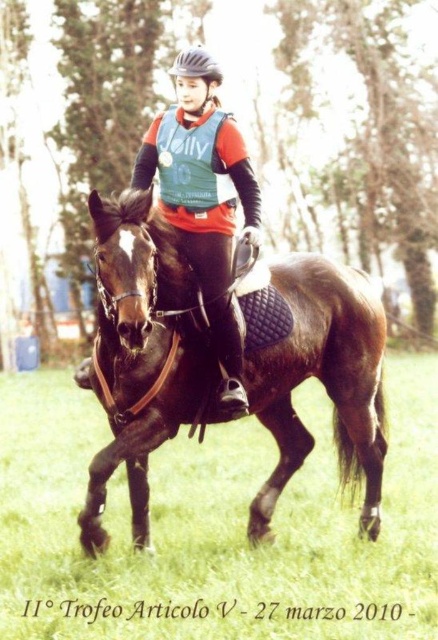
You are a photographer standing at the edge of the field. You want to capture a photo of the brown glossy horse at center and the black matte helmet at upper center in the same frame. Considering the distance between them, will you need to adjust your camera lens to a wider angle to ensure both are fully visible?

The distance between the brown glossy horse at center and the black matte helmet at upper center is 7.55 feet. To capture both in the same frame, you would need to adjust your camera lens to a wider angle since the objects are separated by a significant distance.

You are a photographer who wants to capture a closeup shot of the black matte helmet at upper center without the green grass at center appearing in the frame. Is this possible based on their positions?

The green grass at center might be wider than the black matte helmet at upper center, so it is possible that the grass could still appear in the frame if the helmet is centered. Adjust the camera angle to exclude the grass.